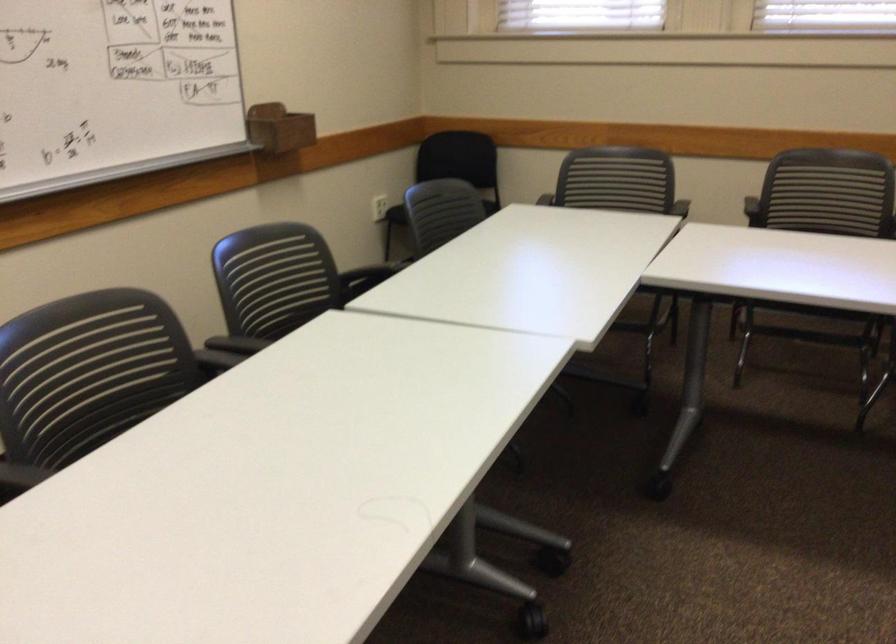
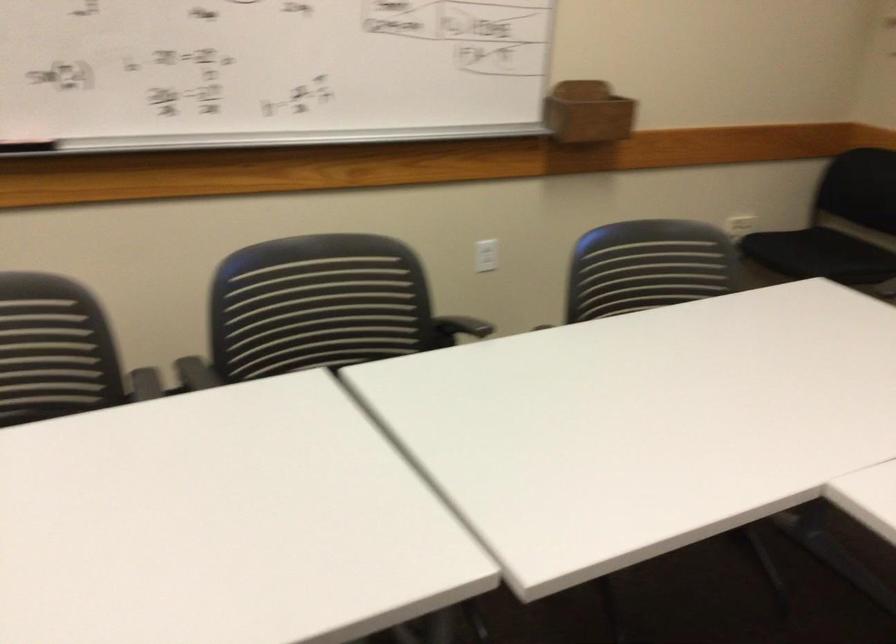
In the second image, find the point that corresponds to (347,279) in the first image.

(458, 328)